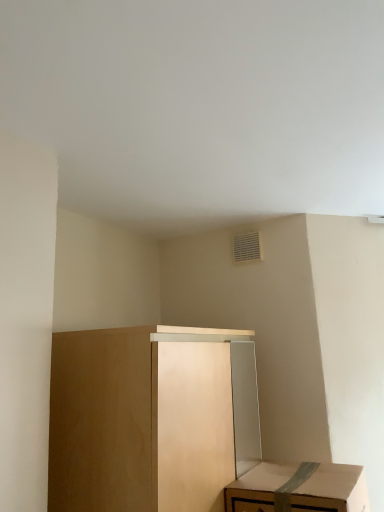
Question: Would you say cardboard box at lower right is to the left or to the right of matte wood cabinet at lower left in the picture?

Choices:
 (A) right
 (B) left

Answer: (A)

Question: Is point (319, 508) positioned closer to the camera than point (175, 369)?

Choices:
 (A) closer
 (B) farther

Answer: (A)

Question: Relative to matte wood cabinet at lower left, is cardboard box at lower right in front or behind?

Choices:
 (A) behind
 (B) front

Answer: (A)

Question: Is matte wood cabinet at lower left taller or shorter than cardboard box at lower right?

Choices:
 (A) short
 (B) tall

Answer: (B)

Question: Looking at their shapes, would you say matte wood cabinet at lower left is wider or thinner than cardboard box at lower right?

Choices:
 (A) wide
 (B) thin

Answer: (A)

Question: Do you think matte wood cabinet at lower left is within cardboard box at lower right, or outside of it?

Choices:
 (A) inside
 (B) outside

Answer: (B)

Question: From a real-world perspective, relative to cardboard box at lower right, is matte wood cabinet at lower left vertically above or below?

Choices:
 (A) below
 (B) above

Answer: (B)